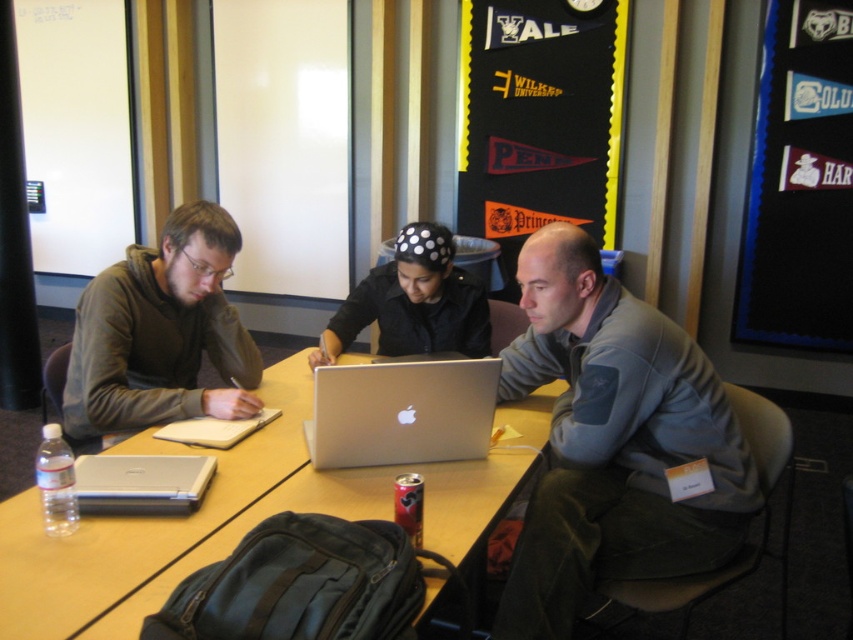
Question: Is matte gray hoodie at left positioned at the back of silver metallic laptop at center?

Choices:
 (A) yes
 (B) no

Answer: (A)

Question: Considering the real-world distances, which object is closest to the matte gray hoodie at left?

Choices:
 (A) gray fleece jacket at center
 (B) matte black shirt at center
 (C) silver metallic laptop at center

Answer: (B)

Question: Is metallic silver pennant at upper right bigger than matte black shirt at center?

Choices:
 (A) yes
 (B) no

Answer: (A)

Question: Among these points, which one is nearest to the camera?

Choices:
 (A) (682, 513)
 (B) (206, 253)

Answer: (A)

Question: Is the position of gray fleece jacket at center more distant than that of wooden table at center?

Choices:
 (A) yes
 (B) no

Answer: (A)

Question: Among these objects, which one is farthest from the camera?

Choices:
 (A) silver metallic laptop at lower left
 (B) metallic silver pennant at upper right
 (C) matte gray hoodie at left

Answer: (B)